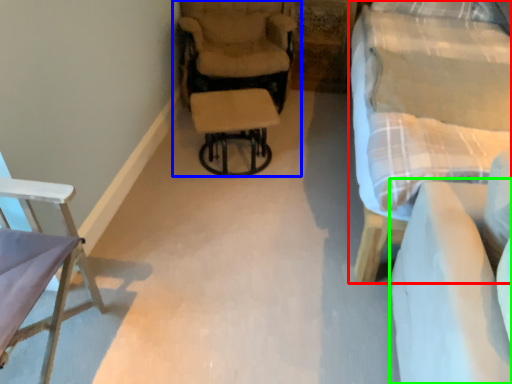
Question: Considering the real-world distances, which object is closest to studio couch (highlighted by a red box)? chair (highlighted by a blue box) or couch (highlighted by a green box).

Choices:
 (A) chair
 (B) couch

Answer: (B)